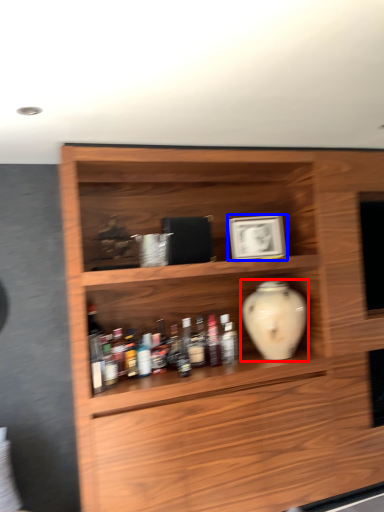
Question: Which of the following is the closest to the observer, vase (highlighted by a red box) or picture frame (highlighted by a blue box)?

Choices:
 (A) vase
 (B) picture frame

Answer: (A)